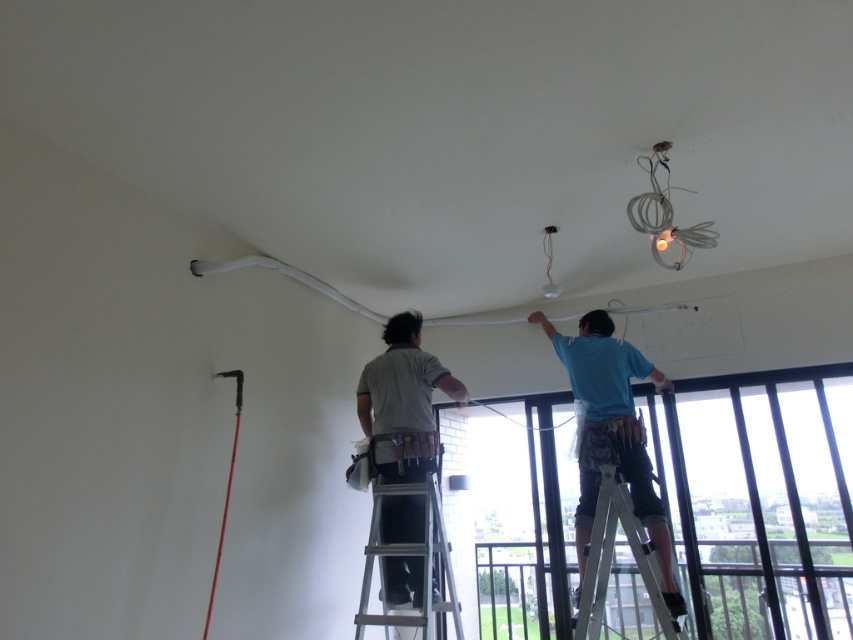
You are a contractor working in the room shown. You need to locate a specific point marked as point (412, 557). Where is this point located in relation to the silver metallic ladder at center?

The point (412, 557) is located on the silver metallic ladder at center.

You are a contractor assessing the safety of the workspace shown in the image. The gray fabric shirt at center and the white metallic ladder at lower right are both present. Based on their sizes, which object is more likely to be stable in this environment?

The gray fabric shirt at center is much taller than the white metallic ladder at lower right, so the white metallic ladder at lower right is more stable because it has a lower center of gravity.